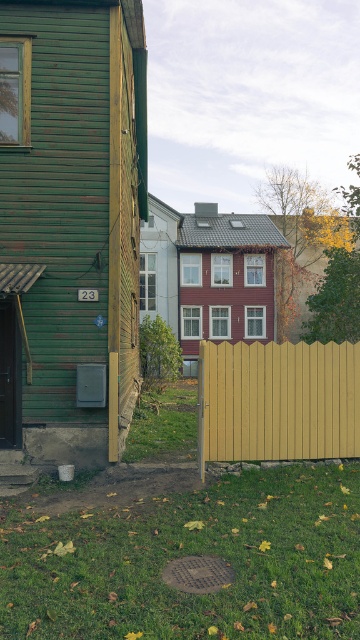
You are a gardener planning to plant flowers in the green grass at lower center. To ensure the flowers are visible from the street, should you plant them closer to the yellow wood fence at center or away from it?

You should plant the flowers closer to the yellow wood fence at center because the green grass at lower center is below the yellow wood fence at center, so positioning them near the fence would make them more visible from the street.

You are a drone operator trying to land a drone on the green grass at lower center. The drone has a GPS coordinate system where the bottom left corner of the image is point 0,0 and the top right corner is point 1,1. What are the coordinates where you should direct the drone to land?

The coordinates for the green grass at lower center are at point (191,554).

You are standing in front of the row of houses and want to determine the relative positions of two points marked in the scene. Which point is closer to you, point (270, 604) or point (317, 372)?

Point (270, 604) is closer to the viewer than point (317, 372).